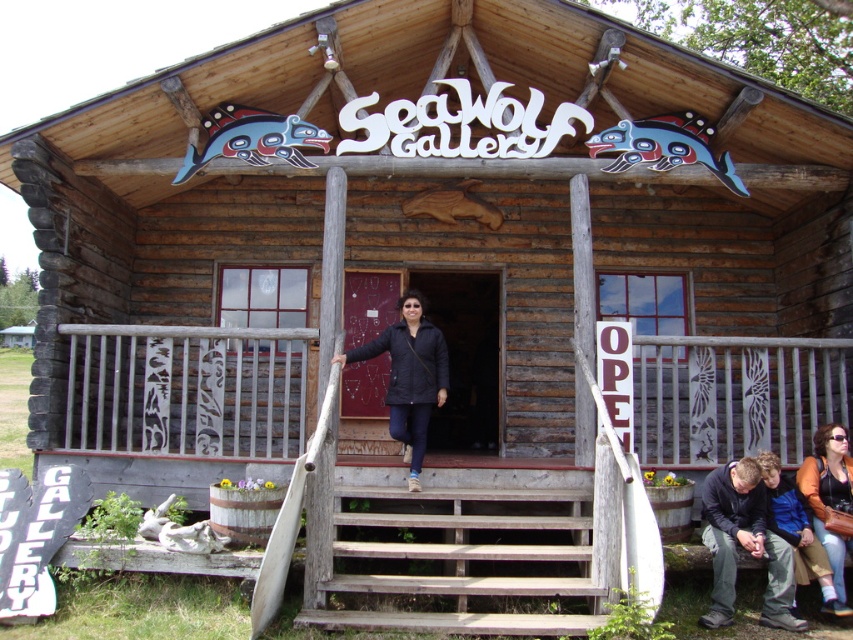
Question: Which point is closer to the camera?

Choices:
 (A) (373, 499)
 (B) (844, 484)
 (C) (782, 541)

Answer: (C)

Question: Can you confirm if dark blue jacket at lower right is positioned above black matte jacket at center?

Choices:
 (A) no
 (B) yes

Answer: (A)

Question: Which point is farther to the camera?

Choices:
 (A) (746, 513)
 (B) (828, 467)
 (C) (378, 544)

Answer: (B)

Question: Considering the relative positions of black matte jacket at center and orange fabric jacket at center in the image provided, where is black matte jacket at center located with respect to orange fabric jacket at center?

Choices:
 (A) right
 (B) left

Answer: (B)

Question: Does weathered wood stairs at center have a lesser width compared to dark blue jacket at lower right?

Choices:
 (A) yes
 (B) no

Answer: (B)

Question: Which of the following is the closest to the observer?

Choices:
 (A) dark blue jacket at lower right
 (B) black matte jacket at center
 (C) weathered wood stairs at center
 (D) orange fabric jacket at center

Answer: (C)